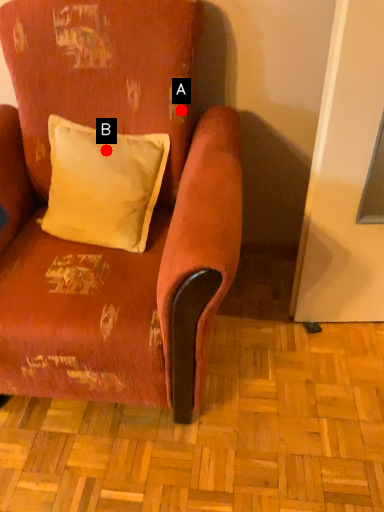
Question: Two points are circled on the image, labeled by A and B beside each circle. Which point appears closest to the camera in this image?

Choices:
 (A) A is closer
 (B) B is closer

Answer: (B)